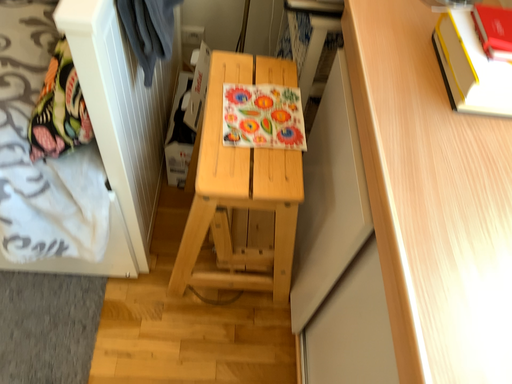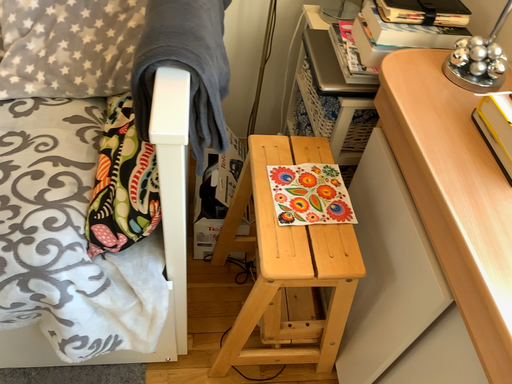
Question: How did the camera likely rotate when shooting the video?

Choices:
 (A) rotated downward
 (B) rotated upward

Answer: (B)